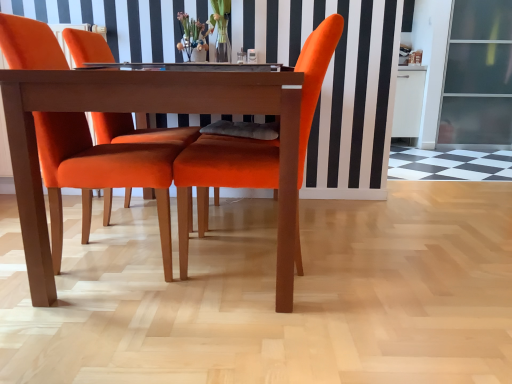
Identify the location of clear glass table at center. The height and width of the screenshot is (384, 512). (189, 67).

In order to face clear glass table at center, should I rotate leftwards or rightwards?

Turn left approximately 7.079 degrees to face it.

What do you see at coordinates (91, 166) in the screenshot? Image resolution: width=512 pixels, height=384 pixels. I see `velvet orange chair at center, arranged as the second chair when viewed from the right` at bounding box center [91, 166].

What do you see at coordinates (194, 38) in the screenshot? This screenshot has width=512, height=384. I see `translucent glass vase at center` at bounding box center [194, 38].

What do you see at coordinates (220, 175) in the screenshot?
I see `velvet orange chair at center, which is counted as the 2th chair, starting from the left` at bounding box center [220, 175].

The width and height of the screenshot is (512, 384). What are the coordinates of `wooden table at center` in the screenshot? It's located at (146, 112).

Which of these two, translucent glass vase at center or wooden table at center, is bigger?

wooden table at center.

Between translucent glass vase at center and wooden table at center, which one has smaller width?

translucent glass vase at center is thinner.

How many degrees apart are the facing directions of translucent glass vase at center and wooden table at center?

0.637 degrees separate the facing orientations of translucent glass vase at center and wooden table at center.

Could you tell me if translucent glass vase at center is facing wooden table at center?

No, translucent glass vase at center is not facing towards wooden table at center.

Which object is positioned more to the right, transparent glass screen door at right or translucent glass vase at center?

From the viewer's perspective, transparent glass screen door at right appears more on the right side.

Looking at this image, is transparent glass screen door at right thinner than translucent glass vase at center?

Incorrect, the width of transparent glass screen door at right is not less than that of translucent glass vase at center.

Is point (496, 41) closer or farther from the camera than point (203, 22)?

Point (496, 41) appears to be farther away from the viewer than point (203, 22).

Between transparent glass screen door at right and translucent glass vase at center, which one has less height?

translucent glass vase at center.

Considering the positions of objects wooden table at center and velvet orange chair at center, placed as the 1th chair when sorted from left to right, in the image provided, who is more to the right, wooden table at center or velvet orange chair at center, placed as the 1th chair when sorted from left to right,?

wooden table at center is more to the right.

Considering the sizes of wooden table at center and velvet orange chair at center, arranged as the second chair when viewed from the right, in the image, is wooden table at center taller or shorter than velvet orange chair at center, arranged as the second chair when viewed from the right,?

Considering their sizes, wooden table at center has less height than velvet orange chair at center, arranged as the second chair when viewed from the right.

From a real-world perspective, is wooden table at center located higher than velvet orange chair at center, arranged as the second chair when viewed from the right?

No, from a real-world perspective, wooden table at center is not above velvet orange chair at center, arranged as the second chair when viewed from the right.

Consider the image. Could you measure the distance between wooden table at center and velvet orange chair at center, arranged as the second chair when viewed from the right?

The distance of wooden table at center from velvet orange chair at center, arranged as the second chair when viewed from the right, is 24.82 centimeters.

From the image's perspective, which one is positioned lower, velvet orange chair at center, positioned as the first chair in right-to-left order, or wooden table at center?

wooden table at center is shown below in the image.

Which object is closer to the camera taking this photo, velvet orange chair at center, positioned as the first chair in right-to-left order, or wooden table at center?

wooden table at center is more forward.

Is velvet orange chair at center, positioned as the first chair in right-to-left order, far from wooden table at center?

That's not correct — velvet orange chair at center, positioned as the first chair in right-to-left order, is a little close to wooden table at center.

Between point (238, 147) and point (18, 142), which one is positioned behind?

Point (238, 147)

Can you tell me how much clear glass table at center and velvet orange chair at center, arranged as the second chair when viewed from the right, differ in facing direction?

178 degrees.

From a real-world perspective, does clear glass table at center sit lower than velvet orange chair at center, placed as the 1th chair when sorted from left to right?

No.

Find the location of a particular element. counter top that is on the right side of velvet orange chair at center, arranged as the second chair when viewed from the right is located at coordinates (189, 67).

Is clear glass table at center oriented towards velvet orange chair at center, placed as the 1th chair when sorted from left to right?

Yes, clear glass table at center is oriented towards velvet orange chair at center, placed as the 1th chair when sorted from left to right.

Is transparent glass screen door at right wider than velvet orange chair at center, arranged as the second chair when viewed from the right?

Correct, the width of transparent glass screen door at right exceeds that of velvet orange chair at center, arranged as the second chair when viewed from the right.

Does transparent glass screen door at right appear on the left side of velvet orange chair at center, placed as the 1th chair when sorted from left to right?

In fact, transparent glass screen door at right is to the right of velvet orange chair at center, placed as the 1th chair when sorted from left to right.

Is the depth of transparent glass screen door at right greater than that of velvet orange chair at center, arranged as the second chair when viewed from the right?

Yes, it is behind velvet orange chair at center, arranged as the second chair when viewed from the right.

How much distance is there between transparent glass screen door at right and velvet orange chair at center, arranged as the second chair when viewed from the right?

They are 3.83 meters apart.

Identify the location of floral arrangement lying above the velvet orange chair at center, which is counted as the 2th chair, starting from the left (from the image's perspective). (194, 38).

In terms of size, does velvet orange chair at center, positioned as the first chair in right-to-left order, appear bigger or smaller than translucent glass vase at center?

Clearly, velvet orange chair at center, positioned as the first chair in right-to-left order, is larger in size than translucent glass vase at center.

Based on their positions, is velvet orange chair at center, positioned as the first chair in right-to-left order, located to the left or right of translucent glass vase at center?

velvet orange chair at center, positioned as the first chair in right-to-left order, is to the right of translucent glass vase at center.

Identify the location of kitchen & dining room table located below the translucent glass vase at center (from the image's perspective). (146, 112).

Find the location of `screen door lying behind the translucent glass vase at center`. screen door lying behind the translucent glass vase at center is located at coordinates (478, 75).

Looking at the image, which one is located further to wooden table at center, velvet orange chair at center, positioned as the first chair in right-to-left order, or velvet orange chair at center, placed as the 1th chair when sorted from left to right?

Based on the image, velvet orange chair at center, positioned as the first chair in right-to-left order, appears to be further to wooden table at center.

Which object lies further to the anchor point translucent glass vase at center, wooden table at center or clear glass table at center?

wooden table at center is further to translucent glass vase at center.

When comparing their distances from wooden table at center, does velvet orange chair at center, arranged as the second chair when viewed from the right, or translucent glass vase at center seem further?

Based on the image, translucent glass vase at center appears to be further to wooden table at center.

When comparing their distances from velvet orange chair at center, arranged as the second chair when viewed from the right, does clear glass table at center or transparent glass screen door at right seem closer?

clear glass table at center lies closer to velvet orange chair at center, arranged as the second chair when viewed from the right, than the other object.

Based on their spatial positions, is transparent glass screen door at right or velvet orange chair at center, arranged as the second chair when viewed from the right, closer to velvet orange chair at center, which is counted as the 2th chair, starting from the left?

Among the two, velvet orange chair at center, arranged as the second chair when viewed from the right, is located nearer to velvet orange chair at center, which is counted as the 2th chair, starting from the left.

From the picture: Considering their positions, is wooden table at center positioned further to clear glass table at center than velvet orange chair at center, which is counted as the 2th chair, starting from the left?

velvet orange chair at center, which is counted as the 2th chair, starting from the left.

Estimate the real-world distances between objects in this image. Which object is further from velvet orange chair at center, which is counted as the 2th chair, starting from the left, translucent glass vase at center or transparent glass screen door at right?

transparent glass screen door at right.

From the image, which object appears to be farther from wooden table at center, translucent glass vase at center or transparent glass screen door at right?

Among the two, transparent glass screen door at right is located further to wooden table at center.

I want to click on counter top between translucent glass vase at center and transparent glass screen door at right from left to right, so click(189, 67).

Find the location of a particular element. Image resolution: width=512 pixels, height=384 pixels. kitchen & dining room table between translucent glass vase at center and transparent glass screen door at right in the horizontal direction is located at coordinates (146, 112).

This screenshot has width=512, height=384. What are the coordinates of `chair positioned between velvet orange chair at center, placed as the 1th chair when sorted from left to right, and translucent glass vase at center from near to far` in the screenshot? It's located at (220, 175).

At what (x,y) coordinates should I click in order to perform the action: click on chair between translucent glass vase at center and transparent glass screen door at right from left to right. Please return your answer as a coordinate pair (x, y). Image resolution: width=512 pixels, height=384 pixels. Looking at the image, I should click on (220, 175).